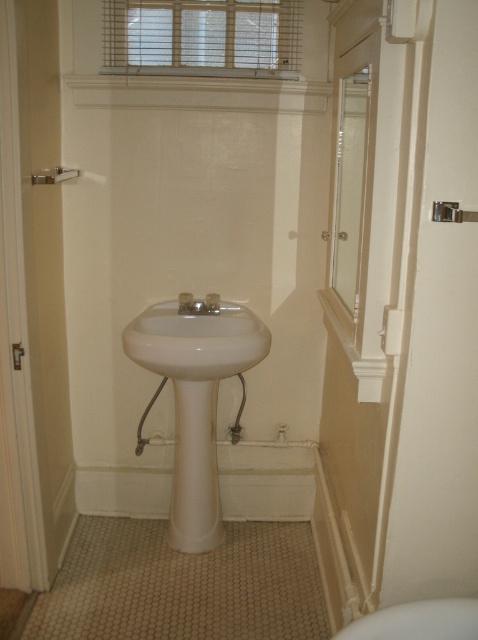
Does white glossy pedestal sink at center have a lesser height compared to white glossy sink at center?

No, white glossy pedestal sink at center is not shorter than white glossy sink at center.

Looking at this image, which is below, white glossy pedestal sink at center or white glossy sink at center?

Positioned lower is white glossy pedestal sink at center.

You are a GUI agent. You are given a task and a screenshot of the screen. Output one action in this format:
    pyautogui.click(x=<x>, y=<y>)
    Task: Click on the white glossy pedestal sink at center
    This screenshot has width=478, height=640.
    Given the screenshot: What is the action you would take?
    pyautogui.click(x=195, y=397)

Image resolution: width=478 pixels, height=640 pixels. What are the coordinates of `white glossy pedestal sink at center` in the screenshot? It's located at (195, 397).

Is clear glass screen door at right below white glossy toilet bowl at lower right?

Incorrect, clear glass screen door at right is not positioned below white glossy toilet bowl at lower right.

Is point (349, 205) positioned in front of point (401, 621)?

No, it is not.

At what (x,y) coordinates should I click in order to perform the action: click on clear glass screen door at right. Please return your answer as a coordinate pair (x, y). The width and height of the screenshot is (478, 640). Looking at the image, I should click on (349, 186).

The height and width of the screenshot is (640, 478). What are the coordinates of `clear glass screen door at right` in the screenshot? It's located at (349, 186).

Does clear glass screen door at right have a greater width compared to brushed metal shower at upper left?

Incorrect, clear glass screen door at right's width does not surpass brushed metal shower at upper left's.

Between point (358, 184) and point (50, 170), which one is positioned behind?

Point (50, 170)

Which is in front, point (351, 227) or point (36, 173)?

Point (351, 227) is in front.

Where is `clear glass screen door at right`? Image resolution: width=478 pixels, height=640 pixels. clear glass screen door at right is located at coordinates (349, 186).